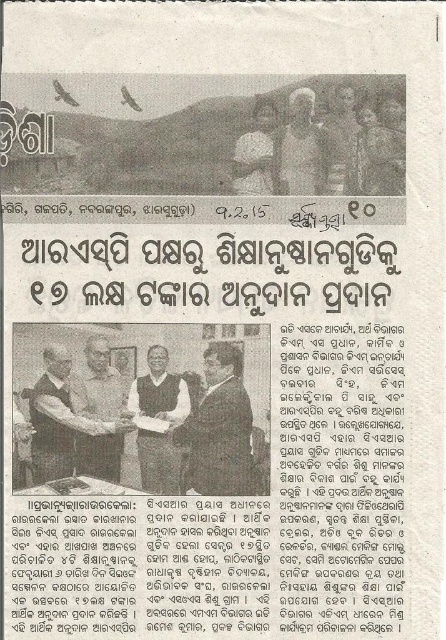
You are a graphic designer working on a layout for a newspaper. You need to place a watermark on the image such that it does not cover any of the objects listed below. The coordinate system is normalized, where the top left corner is at point 0,0 and the bottom right is at 1,1. The watermark should be placed at the top right corner of the image. However, you must ensure that it does not overlap with the light brown leather jacket at center, which is located at point 0.650,0.175. What is the minimum distance

The minimum distance between the watermark placed at the top right corner and the light brown leather jacket at center is 0.325 units. This ensures the watermark does not overlap with the jacket.

You are a fashion designer analyzing the newspaper image. You notice two shirts in the crowd at the center of the photo. The gray textured shirt at center and the matte black shirt at center. Which one has a larger size?

The gray textured shirt at center is larger in size than the matte black shirt at center.

You are a photographer standing 2 meters away from the camera. You want to take a closer shot of the gray textured shirt at center. How much closer do you need to move to ensure the shirt fills the frame properly?

The gray textured shirt at center is currently 1.48 meters away from the camera. To get a closer shot, you need to move 0.52 meters closer so that the distance becomes 0.96 meters, which is ideal for filling the frame.